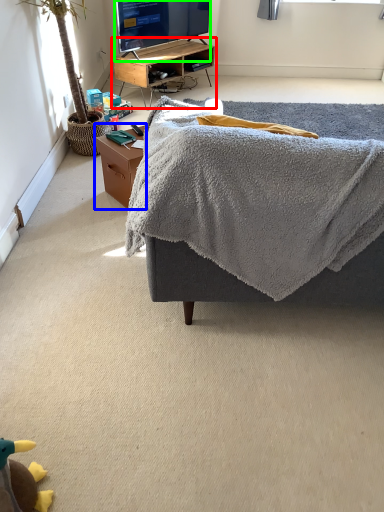
Question: Based on their relative distances, which object is nearer to desk (highlighted by a red box)? Choose from table (highlighted by a blue box) and television (highlighted by a green box).

Choices:
 (A) table
 (B) television

Answer: (B)